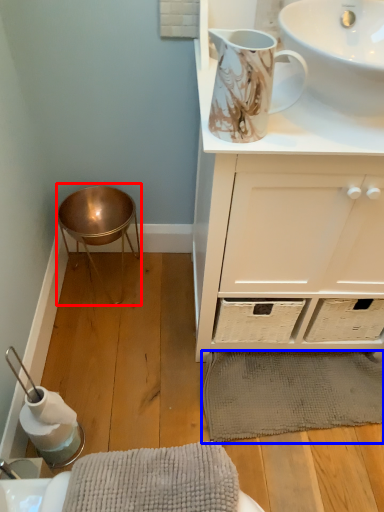
Question: Among these objects, which one is farthest to the camera, bar stool (highlighted by a red box) or bath mat (highlighted by a blue box)?

Choices:
 (A) bar stool
 (B) bath mat

Answer: (A)